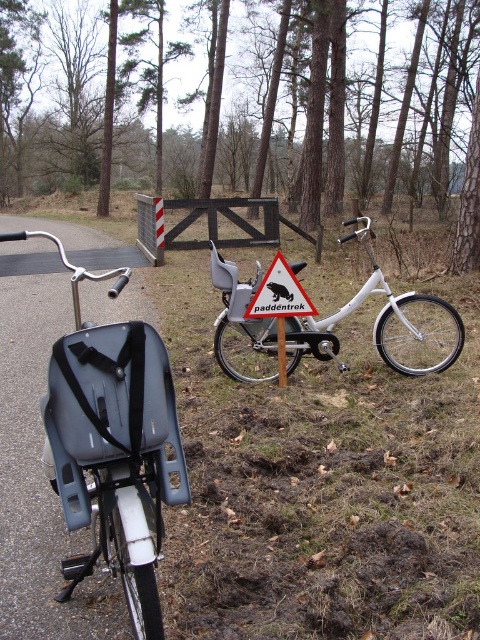
You are a delivery person who needs to attach a package to your bike. You see a matte black bicycle seat at center and a metallic triangular sign at center. Which object is shorter and can you attach the package there?

The matte black bicycle seat at center is shorter than the metallic triangular sign at center, so you can attach the package to the matte black bicycle seat at center.

You are a delivery person who needs to place a small package between the matte black bicycle seat at center and the metallic triangular sign at center. The package requires a minimum of 3 meters of space to be placed safely. Can you fit the package between them?

The distance between the matte black bicycle seat at center and the metallic triangular sign at center is 2.68 meters, which is less than the required 3 meters. Therefore, the package cannot be placed safely between them.